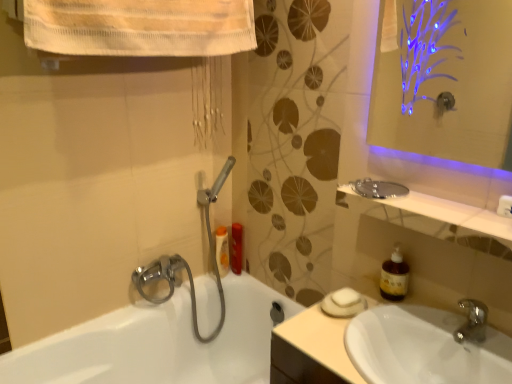
Question: Does brown translucent soap dispenser at right have a lesser width compared to matte plastic bottle at center, the first toiletry when ordered from right to left?

Choices:
 (A) yes
 (B) no

Answer: (A)

Question: Is brown translucent soap dispenser at right bigger than matte plastic bottle at center, marked as the second toiletry in a left-to-right arrangement?

Choices:
 (A) yes
 (B) no

Answer: (A)

Question: Would you say brown translucent soap dispenser at right is outside matte plastic bottle at center, the first toiletry when ordered from right to left?

Choices:
 (A) no
 (B) yes

Answer: (B)

Question: From a real-world perspective, is brown translucent soap dispenser at right positioned over matte plastic bottle at center, the first toiletry when ordered from right to left, based on gravity?

Choices:
 (A) yes
 (B) no

Answer: (A)

Question: Considering the relative sizes of brown translucent soap dispenser at right and matte plastic bottle at center, the first toiletry when ordered from right to left, in the image provided, is brown translucent soap dispenser at right wider than matte plastic bottle at center, the first toiletry when ordered from right to left,?

Choices:
 (A) no
 (B) yes

Answer: (A)

Question: Considering the positions of clear glass mirror at upper right and matte plastic bottle at center, the first toiletry when ordered from right to left, in the image, is clear glass mirror at upper right taller or shorter than matte plastic bottle at center, the first toiletry when ordered from right to left,?

Choices:
 (A) tall
 (B) short

Answer: (B)

Question: Considering their positions, is clear glass mirror at upper right located in front of or behind matte plastic bottle at center, the first toiletry when ordered from right to left?

Choices:
 (A) front
 (B) behind

Answer: (A)

Question: Is clear glass mirror at upper right situated inside matte plastic bottle at center, the first toiletry when ordered from right to left, or outside?

Choices:
 (A) inside
 (B) outside

Answer: (B)

Question: Visually, is clear glass mirror at upper right positioned to the left or to the right of matte plastic bottle at center, the first toiletry when ordered from right to left?

Choices:
 (A) left
 (B) right

Answer: (B)

Question: Based on their positions, is white glossy sink at lower right located to the left or right of white matte soap at sink?

Choices:
 (A) left
 (B) right

Answer: (B)

Question: Considering their positions, is white glossy sink at lower right located in front of or behind white matte soap at sink?

Choices:
 (A) behind
 (B) front

Answer: (B)

Question: Is white glossy sink at lower right wider or thinner than white matte soap at sink?

Choices:
 (A) thin
 (B) wide

Answer: (B)

Question: Is point (433, 359) closer or farther from the camera than point (337, 296)?

Choices:
 (A) farther
 (B) closer

Answer: (B)

Question: Does point (478, 238) appear closer or farther from the camera than point (218, 244)?

Choices:
 (A) closer
 (B) farther

Answer: (A)

Question: In terms of height, does clear glass mirror at upper right look taller or shorter compared to orange glossy lotion at upper left, the second toiletry when ordered from right to left?

Choices:
 (A) tall
 (B) short

Answer: (B)